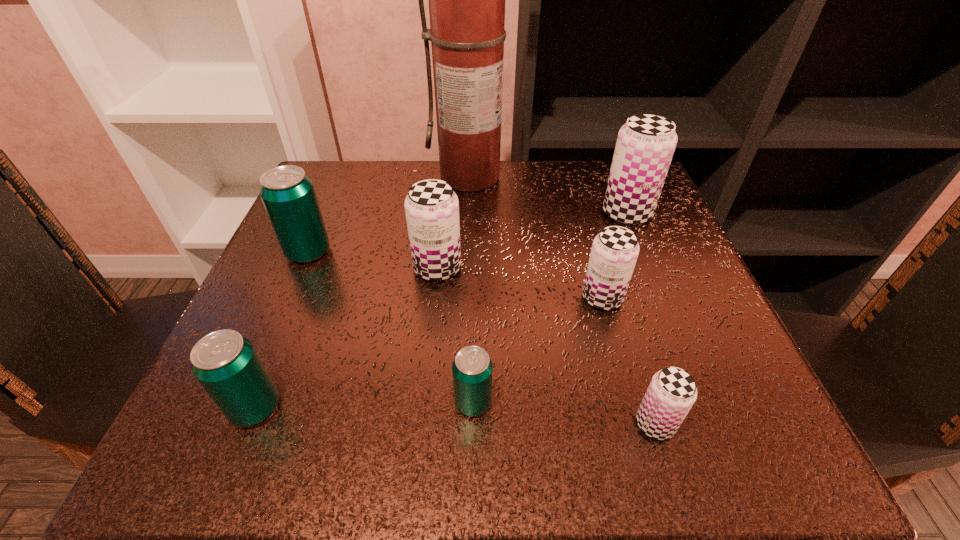
Image resolution: width=960 pixels, height=540 pixels. Identify the location of free location that satisfies the following two spatial constraints: 1. on the front side of the second biggest purple beer can; 2. on the left side of the second smallest purple beer can. (435, 298).